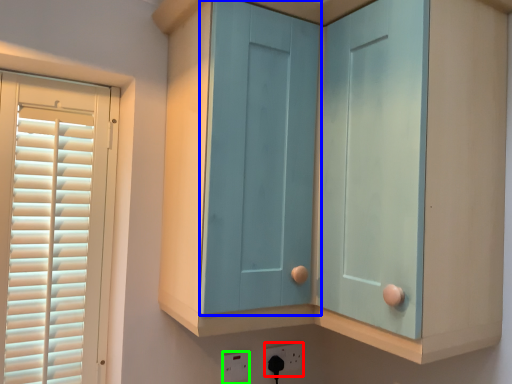
Question: Considering the real-world distances, which object is closest to electric outlet (highlighted by a red box)? screen door (highlighted by a blue box) or electric outlet (highlighted by a green box).

Choices:
 (A) screen door
 (B) electric outlet

Answer: (B)